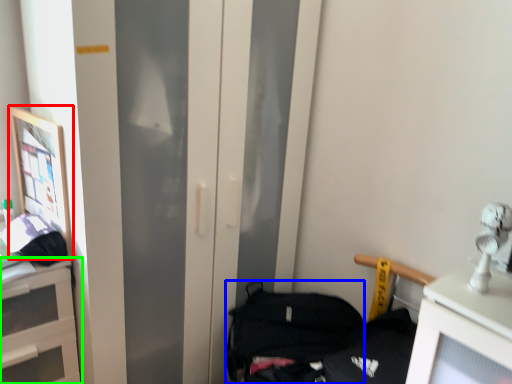
Question: Which object is the closest to the picture frame (highlighted by a red box)? Choose among these: handbag (highlighted by a blue box) or cabinetry (highlighted by a green box).

Choices:
 (A) handbag
 (B) cabinetry

Answer: (B)